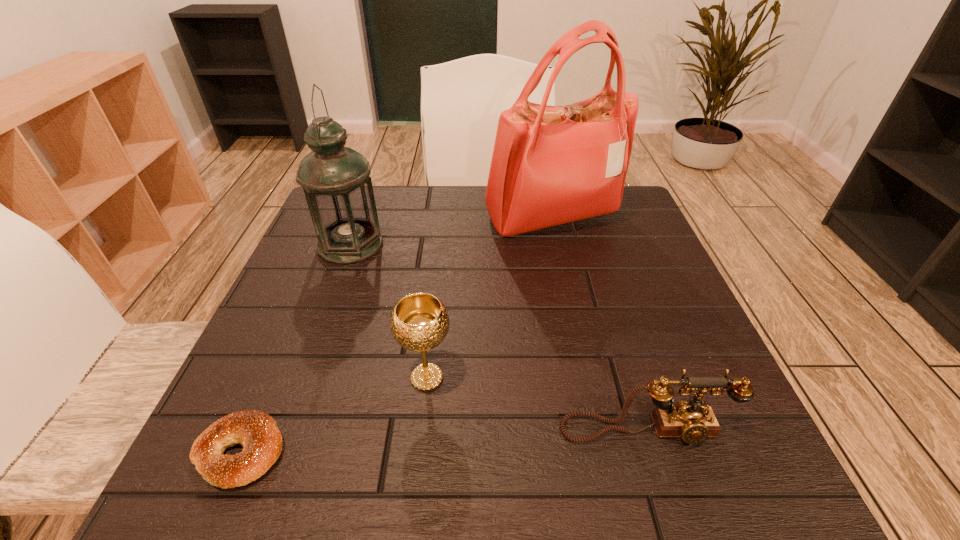
Identify the location of empty space that is in between the third nearest object and the telephone. (x=536, y=404).

This screenshot has height=540, width=960. Identify the location of free space between the handbag and the fourth shortest object. (451, 231).

Locate an element on the screen. unoccupied area between the second shortest object and the oil lamp is located at coordinates (498, 338).

Where is `free area in between the chalice and the handbag`? Image resolution: width=960 pixels, height=540 pixels. free area in between the chalice and the handbag is located at coordinates (489, 298).

This screenshot has height=540, width=960. What are the coordinates of `empty space that is in between the telephone and the tallest object` in the screenshot? It's located at (598, 324).

Locate an element on the screen. empty location between the tallest object and the third nearest object is located at coordinates (489, 298).

This screenshot has height=540, width=960. I want to click on empty space between the telephone and the oil lamp, so click(x=498, y=338).

Find the location of a particular element. blank region between the fourth shortest object and the chalice is located at coordinates (389, 311).

Identify which object is the fourth nearest to the third farthest object. Please provide its 2D coordinates. Your answer should be formatted as a tuple, i.e. [(x, y)], where the tuple contains the x and y coordinates of a point satisfying the conditions above.

[(551, 165)]

Find the location of `object that is the second closest one to the shortest object`. object that is the second closest one to the shortest object is located at coordinates (336, 181).